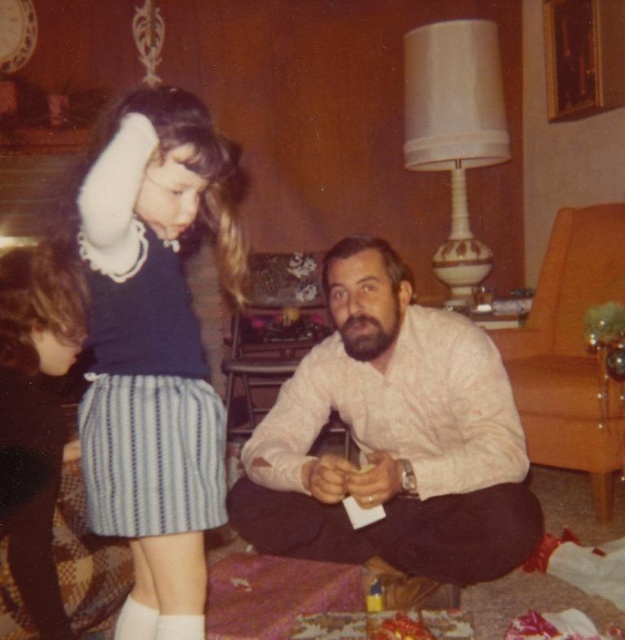
You are a photographer trying to capture a candid shot of the scene. You want to ensure both the white textured shirt at center and the white soft sock at lower left are visible in the frame. Based on their positions, which object should you focus on first to include both in the shot?

The white textured shirt at center is positioned on the right side of white soft sock at lower left, so focusing on the white textured shirt at center first would help ensure both objects are included in the frame since it is closer to the center and the sock is to its left.

You are a tailor observing the scene and need to determine which item is taller between the white textured shirt at center and the white soft sock at lower left. Based on the scene, which one is taller?

The white textured shirt at center is taller than the white soft sock at lower left according to the description.